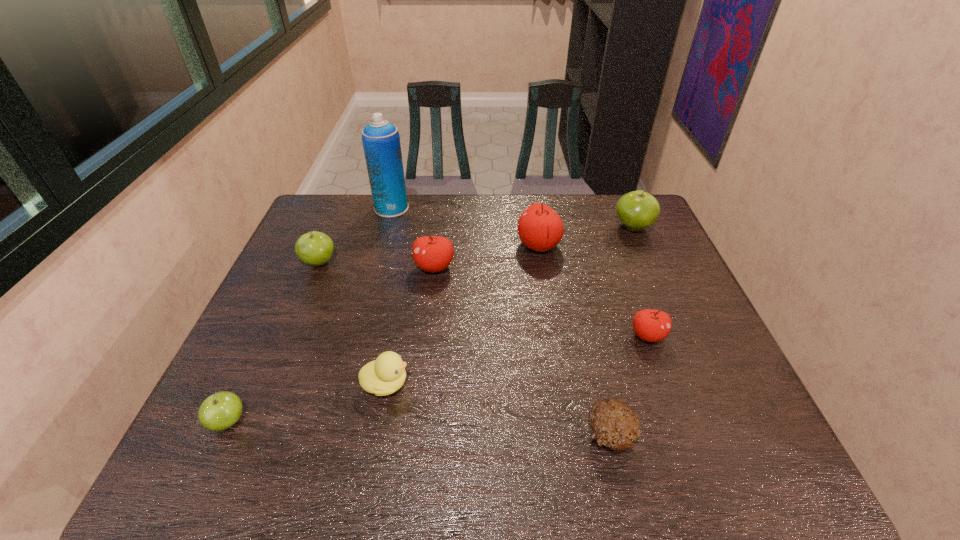
This screenshot has width=960, height=540. In order to click on vacant point that satisfies the following two spatial constraints: 1. on the front side of the rightmost red apple; 2. on the right side of the second smallest green apple in this screenshot , I will do `click(288, 336)`.